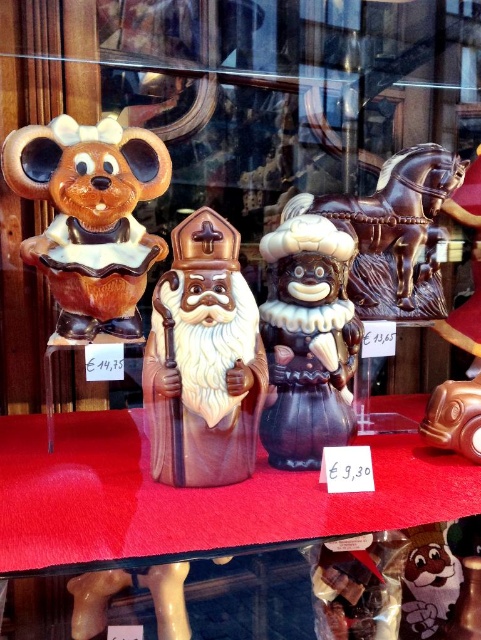
Looking at this image, does brown glossy chocolate figure at center lie in front of shiny chocolate figurine at center?

Yes, brown glossy chocolate figure at center is closer to the viewer.

Locate an element on the screen. brown glossy chocolate figure at center is located at coordinates (203, 360).

Can you confirm if shiny chocolate figurine at center is wider than shiny chocolate horse at center?

In fact, shiny chocolate figurine at center might be narrower than shiny chocolate horse at center.

Is shiny chocolate figurine at center further to the viewer compared to shiny chocolate horse at center?

No, it is not.

Does point (338, 358) come farther from viewer compared to point (453, 184)?

No, (338, 358) is closer to viewer.

Image resolution: width=481 pixels, height=640 pixels. I want to click on shiny chocolate figurine at center, so click(307, 340).

Consider the image. Which is more to the right, brown glossy mouse at left or shiny chocolate horse at center?

Positioned to the right is shiny chocolate horse at center.

Between brown glossy mouse at left and shiny chocolate horse at center, which one is positioned lower?

brown glossy mouse at left is below.

Does point (139, 177) come in front of point (371, 204)?

Yes, it is.

Where is `brown glossy mouse at left`? This screenshot has height=640, width=481. brown glossy mouse at left is located at coordinates (90, 218).